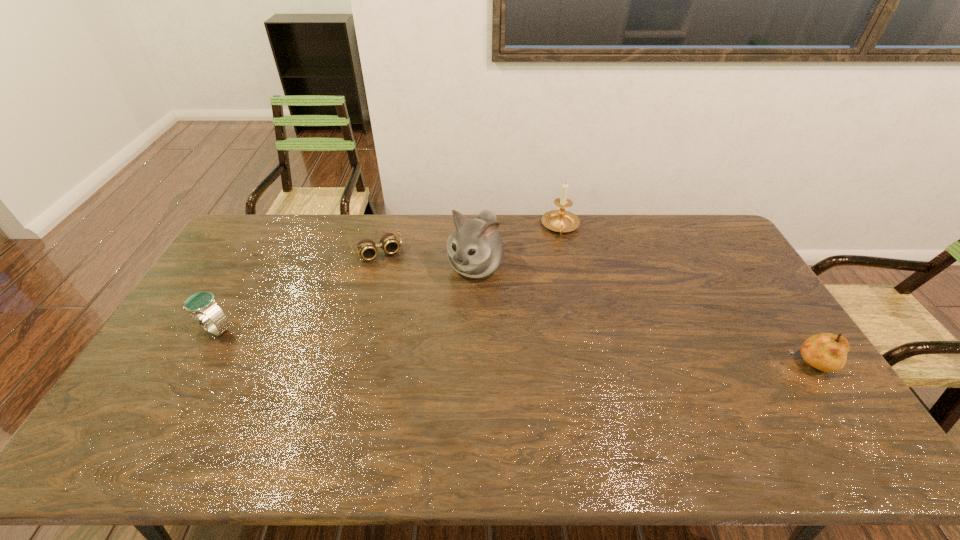
Where is `vacant space on the desktop that is between the fourth farthest object and the nearest object and is positioned on the face of the hamster`? vacant space on the desktop that is between the fourth farthest object and the nearest object and is positioned on the face of the hamster is located at coordinates (431, 342).

At what (x,y) coordinates should I click in order to perform the action: click on vacant spot on the desktop that is between the watch and the nearest object and is positioned through the lenses of the goggles. Please return your answer as a coordinate pair (x, y). This screenshot has width=960, height=540. Looking at the image, I should click on (419, 341).

Locate an element on the screen. The image size is (960, 540). vacant spot on the desktop that is between the fourth farthest object and the rightmost object and is positioned with a handle on the side of the fourth object from left to right is located at coordinates (575, 350).